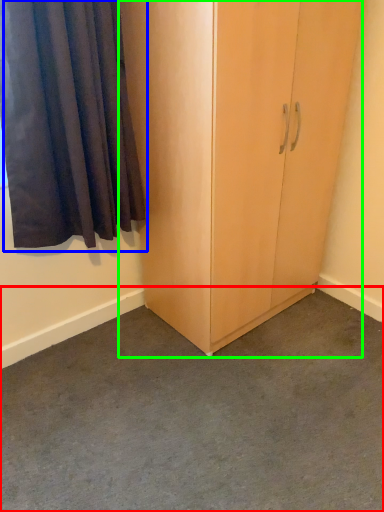
Question: Based on their relative distances, which object is farther from concrete (highlighted by a red box)? Choose from curtain (highlighted by a blue box) and cupboard (highlighted by a green box).

Choices:
 (A) curtain
 (B) cupboard

Answer: (A)